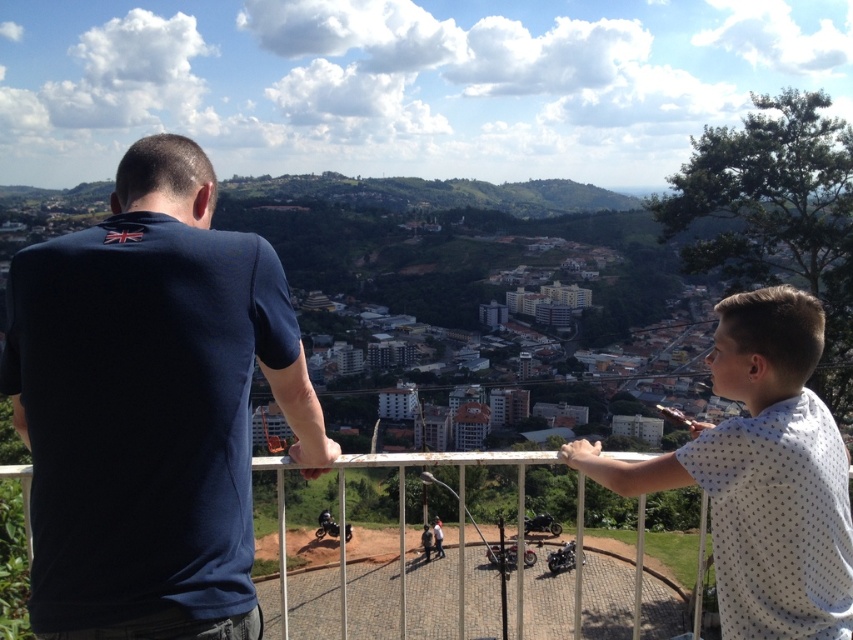
Question: Considering the real-world distances, which object is closest to the white dotted shirt at upper right?

Choices:
 (A) dark blue t-shirt at upper left
 (B) brown dirt track at center
 (C) white metal fence at center
 (D) shiny black motorcycle at center

Answer: (C)

Question: Is white metal fence at center below brown dirt track at center?

Choices:
 (A) no
 (B) yes

Answer: (A)

Question: Which of the following is the farthest from the observer?

Choices:
 (A) (637, 474)
 (B) (100, 410)

Answer: (A)

Question: Does white dotted shirt at upper right have a greater width compared to brown dirt track at center?

Choices:
 (A) yes
 (B) no

Answer: (B)

Question: Observing the image, what is the correct spatial positioning of white dotted shirt at upper right in reference to white metal fence at center?

Choices:
 (A) left
 (B) right

Answer: (B)

Question: Which object appears farthest from the camera in this image?

Choices:
 (A) dark blue t-shirt at upper left
 (B) white metal fence at center

Answer: (B)